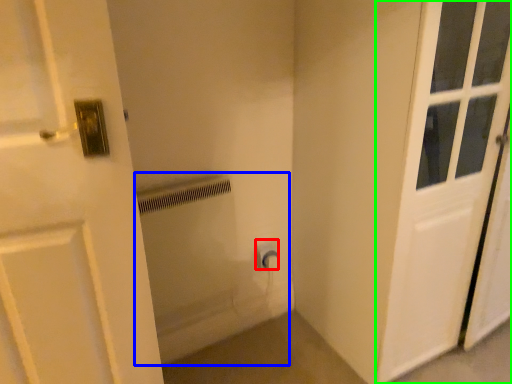
Question: Based on their relative distances, which object is farther from electric outlet (highlighted by a red box)? Choose from bath (highlighted by a blue box) and door (highlighted by a green box).

Choices:
 (A) bath
 (B) door

Answer: (B)